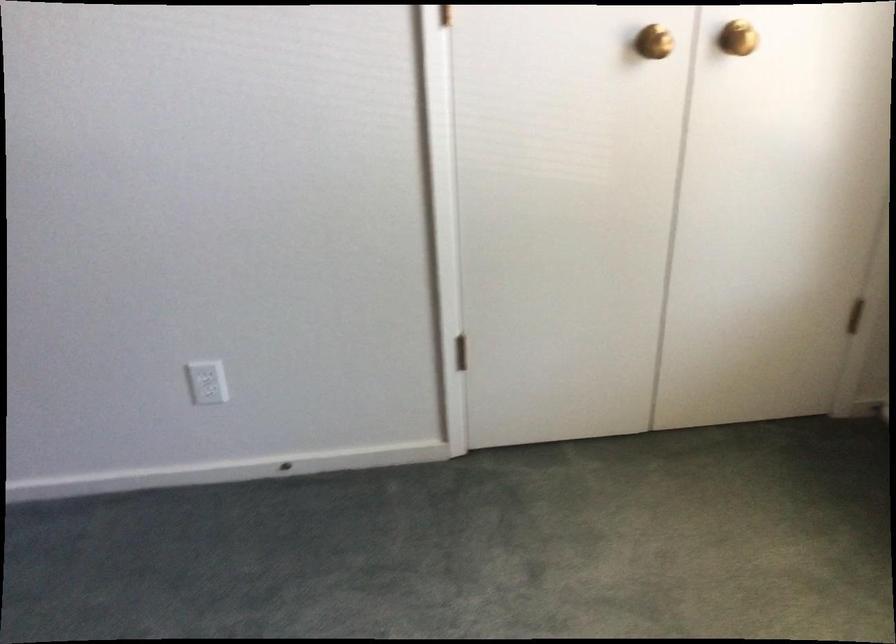
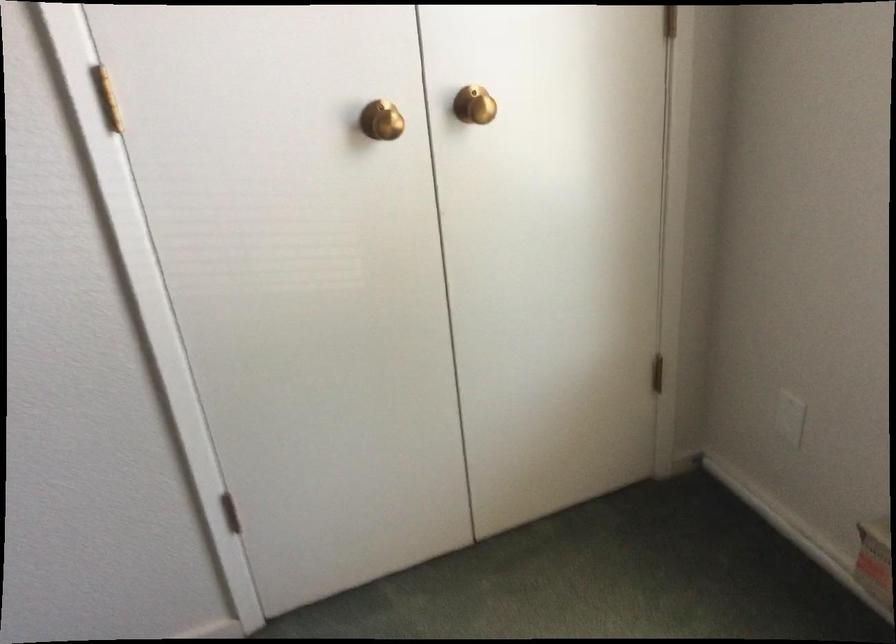
Question: The camera is either moving clockwise (left) or counter-clockwise (right) around the object. The first image is from the beginning of the video and the second image is from the end. Is the camera moving left or right when shooting the video?

Choices:
 (A) Left
 (B) Right

Answer: (A)